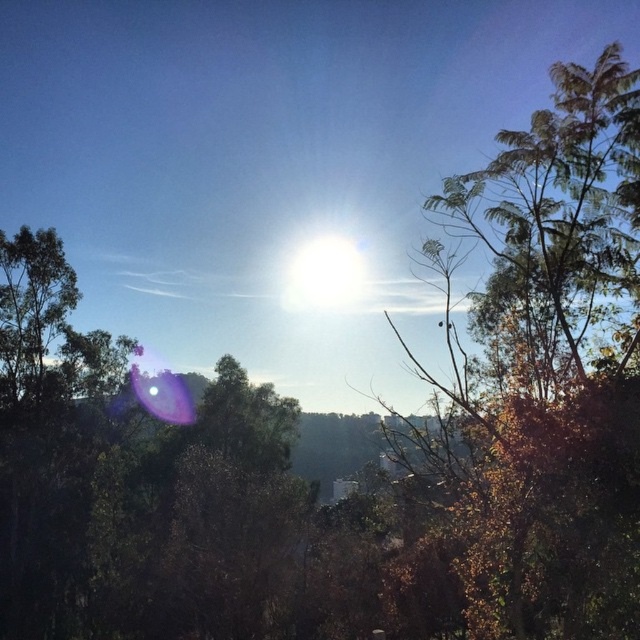
Who is positioned more to the right, green leafy tree at upper right or bright white sun at center?

green leafy tree at upper right

Looking at this image, can you confirm if green leafy tree at upper right is positioned above bright white sun at center?

Correct, green leafy tree at upper right is located above bright white sun at center.

Who is more distant from viewer, (472, 481) or (355, 252)?

The point (355, 252) is behind.

At what (x,y) coordinates should I click in order to perform the action: click on green leafy tree at upper right. Please return your answer as a coordinate pair (x, y). Looking at the image, I should click on (541, 376).